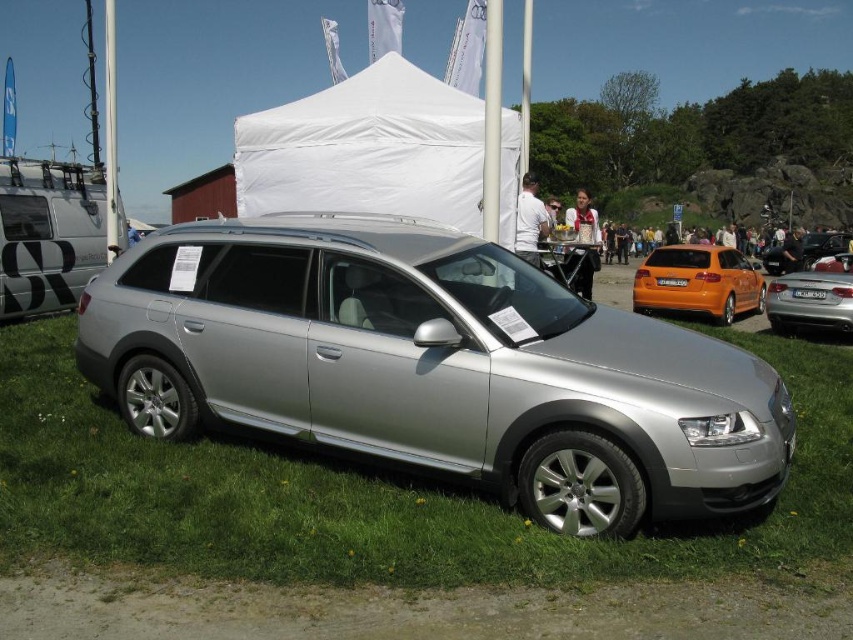
Which is more to the left, white fabric tent at upper center or yellow matte license plate at center?

Positioned to the left is white fabric tent at upper center.

Is white fabric tent at upper center thinner than yellow matte license plate at center?

No.

Find the location of `white fabric tent at upper center`. white fabric tent at upper center is located at coordinates (367, 148).

The height and width of the screenshot is (640, 853). I want to click on white fabric tent at upper center, so click(x=367, y=148).

Can you confirm if orange matte hatchback at center right is positioned to the right of white plastic license plate at center?

In fact, orange matte hatchback at center right is to the left of white plastic license plate at center.

Does point (675, 304) come closer to viewer compared to point (817, 298)?

No, it is not.

Is point (762, 305) more distant than point (811, 289)?

Yes, it is.

Locate an element on the screen. Image resolution: width=853 pixels, height=640 pixels. orange matte hatchback at center right is located at coordinates (699, 282).

Does point (302, 330) lie behind point (802, 298)?

No, (302, 330) is closer to viewer.

Is satin silver wagon at center thinner than white plastic license plate at center?

In fact, satin silver wagon at center might be wider than white plastic license plate at center.

Is point (561, 474) less distant than point (809, 291)?

Yes, it is.

The height and width of the screenshot is (640, 853). Identify the location of satin silver wagon at center. (434, 365).